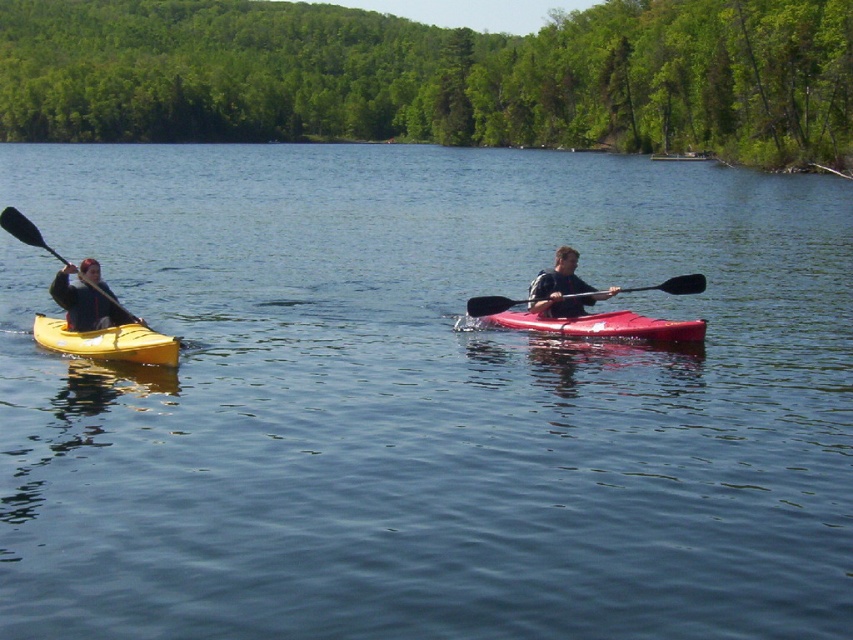
Question: Can you confirm if matte black jacket at left is positioned above black rubber paddle at left?

Choices:
 (A) yes
 (B) no

Answer: (B)

Question: Can you confirm if matte yellow kayak at left is wider than matte black jacket at left?

Choices:
 (A) yes
 (B) no

Answer: (A)

Question: Which object is closer to the camera taking this photo?

Choices:
 (A) matte black jacket at left
 (B) black rubber paddle at right

Answer: (A)

Question: Which of the following is the farthest from the observer?

Choices:
 (A) [567, 280]
 (B) [68, 348]
 (C) [39, 243]
 (D) [679, 282]

Answer: (A)

Question: Which is nearer to the black rubber paddle at left?

Choices:
 (A) black rubber paddle at right
 (B) shiny red kayak at center
 (C) matte black kayak at right

Answer: (A)

Question: Is shiny red kayak at center to the right of matte black jacket at left from the viewer's perspective?

Choices:
 (A) yes
 (B) no

Answer: (A)